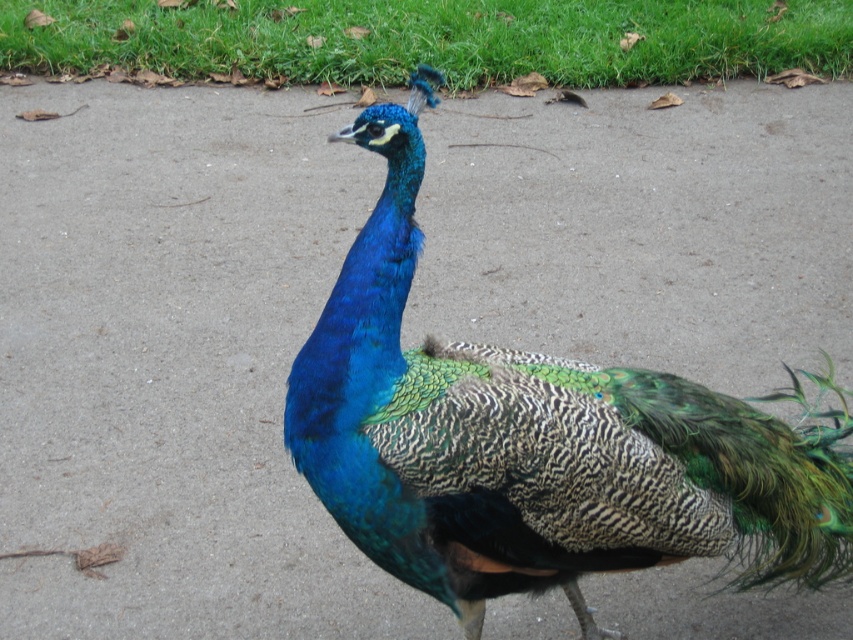
You are a photographer trying to capture the shiny blue peacock at center and the green grass at upper center in a single shot. Which object should you focus on first to ensure both are in frame?

The shiny blue peacock at center is in front of the green grass at upper center, so you should focus on the shiny blue peacock at center first to ensure both are in frame.

You are standing at the point marked by the coordinates point [535,442]. Looking around, you see the shiny blue peacock at center. Which direction should you face to look towards the grassy area in the background?

The grassy area in the background is behind the shiny blue peacock at center, so you should face the direction opposite to the peacock to see the grassy area.

You are a photographer trying to capture the shiny blue peacock at center and the green grass at upper center in a single frame. Which object will appear wider in the photo?

The green grass at upper center will appear wider in the photo because the shiny blue peacock at center has a smaller width compared to the green grass at upper center.